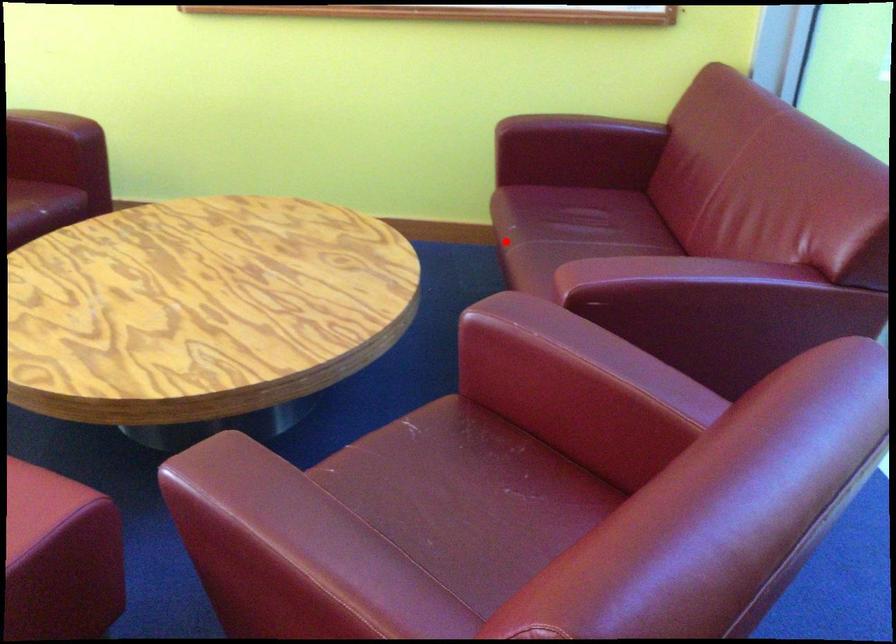
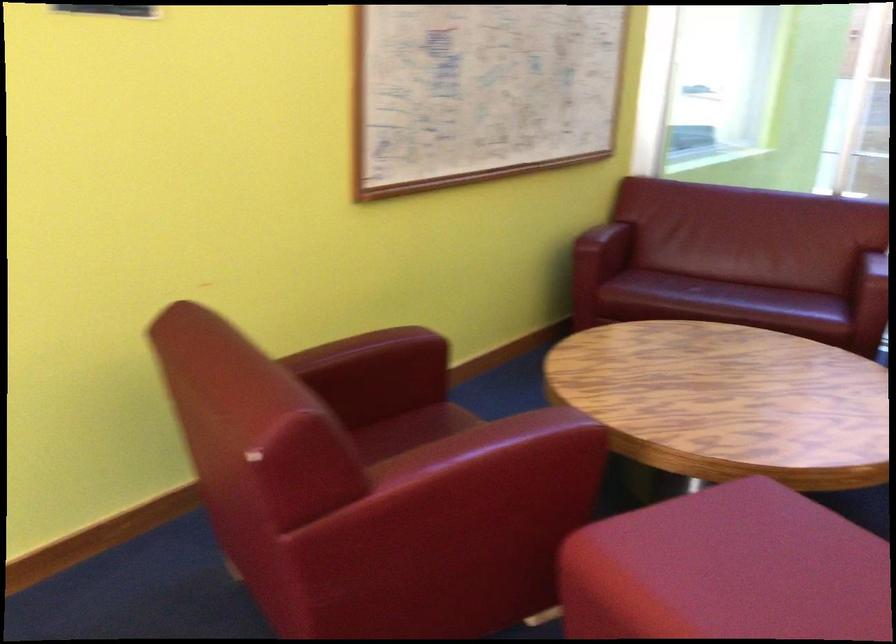
Locate, in the second image, the point that corresponds to the highlighted location in the first image.

(719, 297)